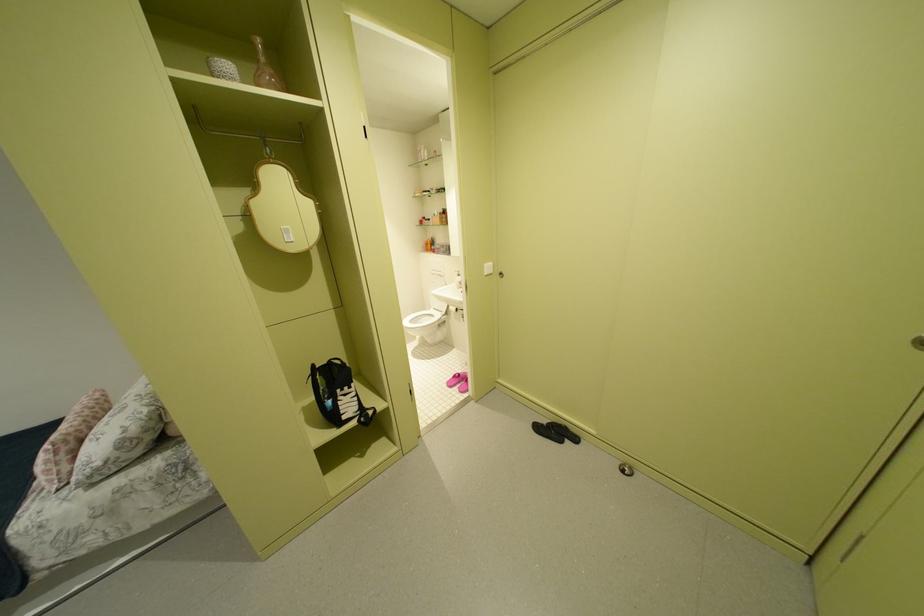
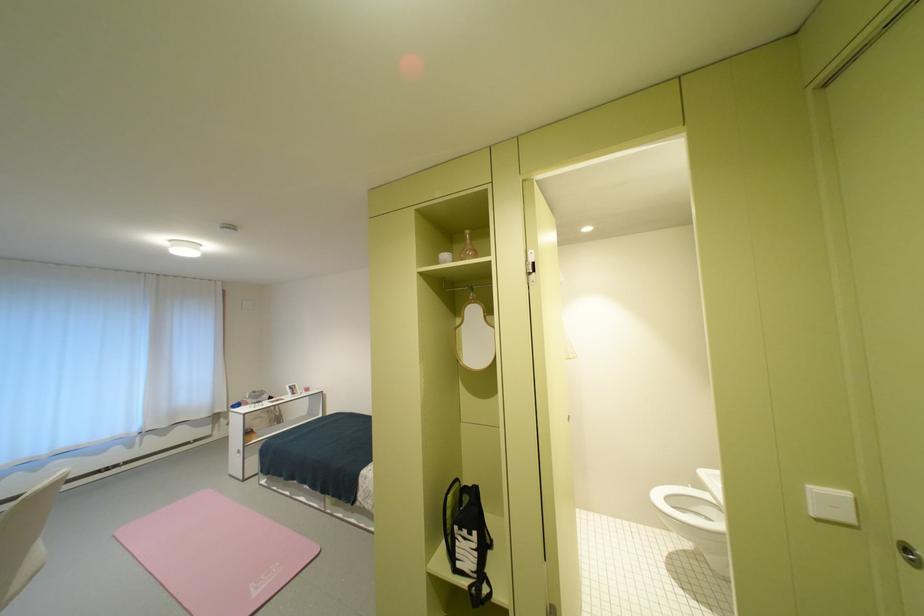
The point at (420, 323) is marked in the first image. Where is the corresponding point in the second image?

(677, 500)